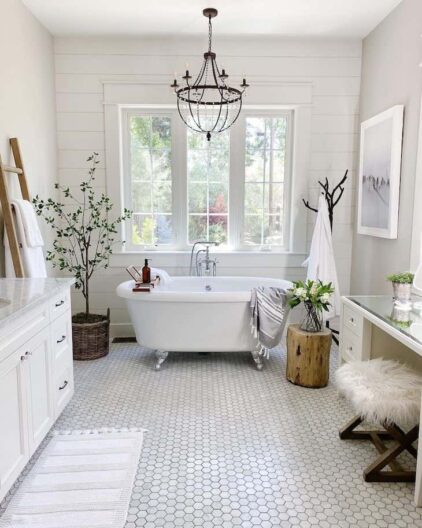
I want to click on white framed picture, so click(x=371, y=197).